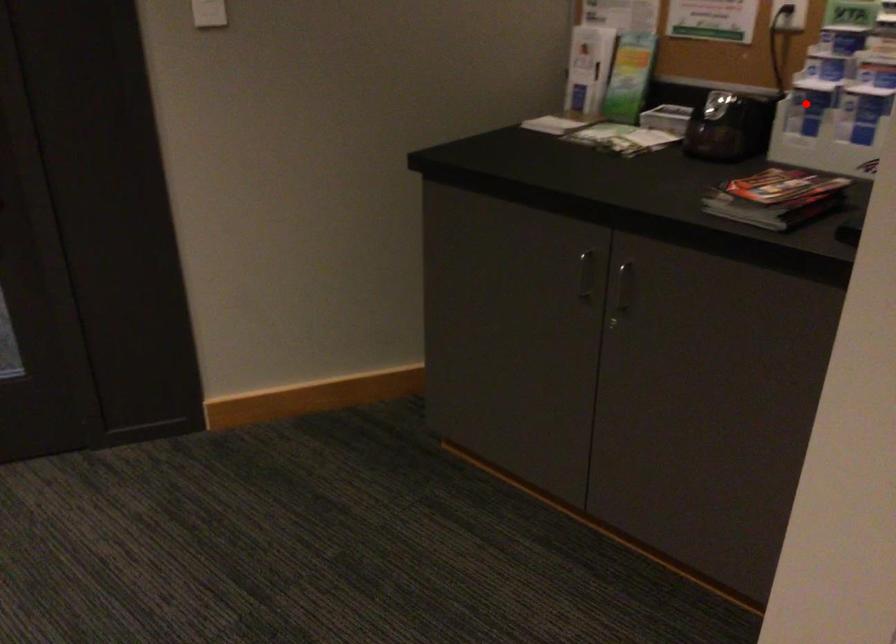
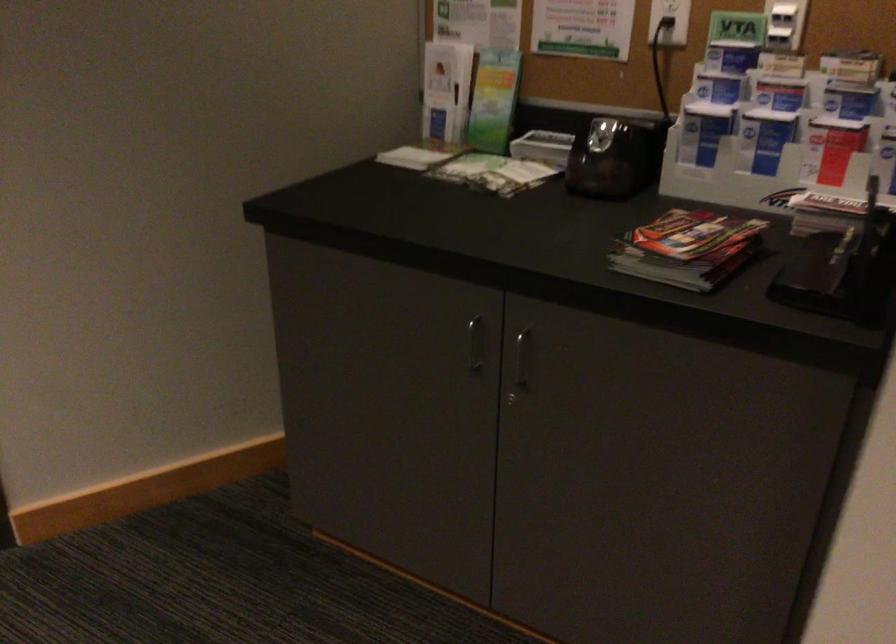
Find the pixel in the second image that matches the highlighted location in the first image.

(702, 131)